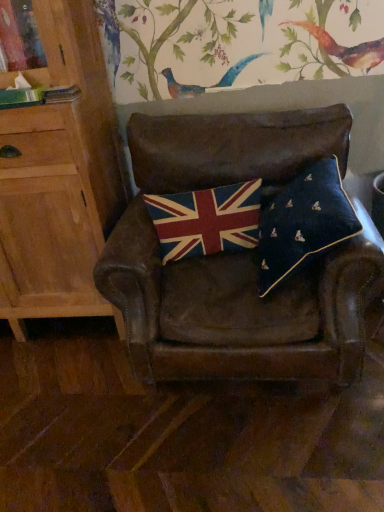
Question: Should I look upward or downward to see leather chair at center?

Choices:
 (A) up
 (B) down

Answer: (A)

Question: Considering the relative sizes of light wood cabinet at left and textured woolen flag at center in the image provided, is light wood cabinet at left smaller than textured woolen flag at center?

Choices:
 (A) yes
 (B) no

Answer: (B)

Question: Does light wood cabinet at left have a lesser height compared to textured woolen flag at center?

Choices:
 (A) no
 (B) yes

Answer: (A)

Question: Is light wood cabinet at left taller than textured woolen flag at center?

Choices:
 (A) no
 (B) yes

Answer: (B)

Question: Considering the relative sizes of light wood cabinet at left and textured woolen flag at center in the image provided, is light wood cabinet at left bigger than textured woolen flag at center?

Choices:
 (A) yes
 (B) no

Answer: (A)

Question: From a real-world perspective, does light wood cabinet at left sit lower than textured woolen flag at center?

Choices:
 (A) yes
 (B) no

Answer: (B)

Question: Is light wood cabinet at left in contact with textured woolen flag at center?

Choices:
 (A) no
 (B) yes

Answer: (A)

Question: Considering the relative sizes of navy velvet pillow at center and light wood cabinet at left in the image provided, is navy velvet pillow at center taller than light wood cabinet at left?

Choices:
 (A) yes
 (B) no

Answer: (B)

Question: Is navy velvet pillow at center wider than light wood cabinet at left?

Choices:
 (A) no
 (B) yes

Answer: (A)

Question: Does navy velvet pillow at center have a lesser height compared to light wood cabinet at left?

Choices:
 (A) yes
 (B) no

Answer: (A)

Question: Is navy velvet pillow at center further to camera compared to light wood cabinet at left?

Choices:
 (A) yes
 (B) no

Answer: (B)

Question: From the image's perspective, is navy velvet pillow at center below light wood cabinet at left?

Choices:
 (A) yes
 (B) no

Answer: (A)

Question: Is light wood cabinet at left inside navy velvet pillow at center?

Choices:
 (A) yes
 (B) no

Answer: (B)

Question: Does textured woolen flag at center contain navy velvet pillow at center?

Choices:
 (A) yes
 (B) no

Answer: (B)